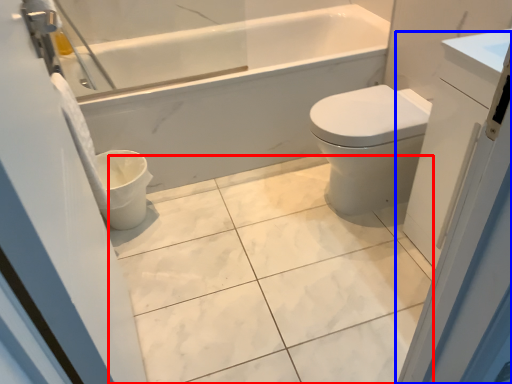
Question: Which object appears closest to the camera in this image, ceramic tile (highlighted by a red box) or screen door (highlighted by a blue box)?

Choices:
 (A) ceramic tile
 (B) screen door

Answer: (B)